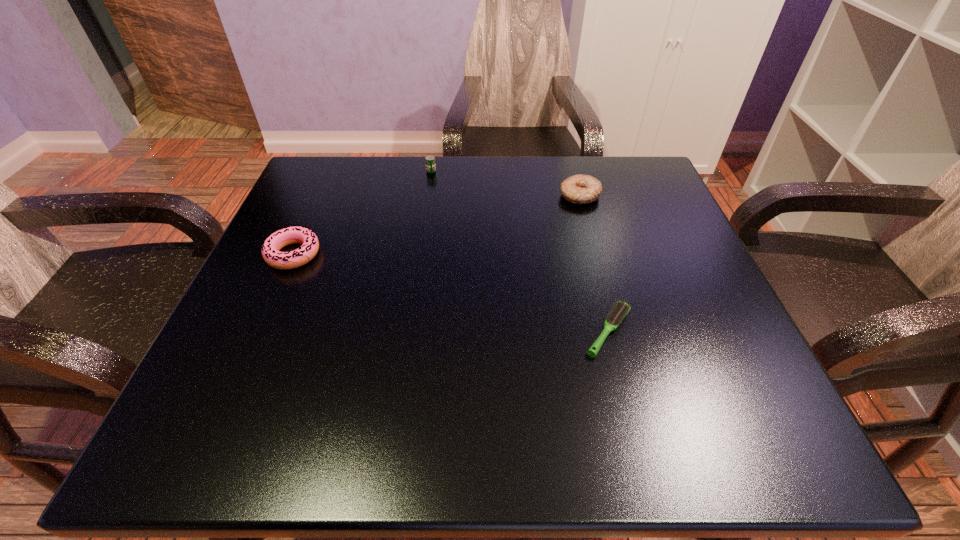
You are a GUI agent. You are given a task and a screenshot of the screen. Output one action in this format:
    pyautogui.click(x=<x>, y=<y>)
    Task: Click on the second object from left to right
    Image resolution: width=960 pixels, height=540 pixels.
    Given the screenshot: What is the action you would take?
    pyautogui.click(x=429, y=160)

In order to click on beer can in this screenshot , I will do `click(429, 160)`.

I want to click on the farther doughnut, so click(578, 189).

Find the location of a particular element. the right doughnut is located at coordinates (578, 189).

You are a GUI agent. You are given a task and a screenshot of the screen. Output one action in this format:
    pyautogui.click(x=<x>, y=<y>)
    Task: Click on the leftmost object
    The image size is (960, 540).
    Given the screenshot: What is the action you would take?
    [x=271, y=247]

Image resolution: width=960 pixels, height=540 pixels. What are the coordinates of `the left doughnut` in the screenshot? It's located at click(x=271, y=247).

Locate an element on the screen. the shortest object is located at coordinates (620, 309).

You are a GUI agent. You are given a task and a screenshot of the screen. Output one action in this format:
    pyautogui.click(x=<x>, y=<y>)
    Task: Click on the hairbrush
    This screenshot has width=960, height=540.
    Given the screenshot: What is the action you would take?
    pyautogui.click(x=620, y=309)

In order to click on vacant space positioned 0.100m on the left of the farthest object in this screenshot , I will do `click(385, 171)`.

Locate an element on the screen. vacant space located on the right of the farther doughnut is located at coordinates (654, 196).